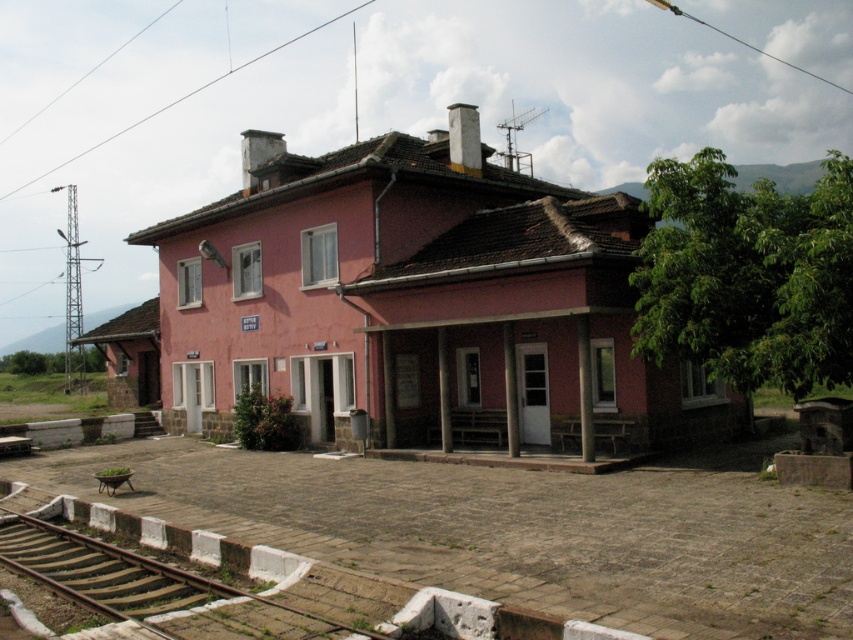
You are a delivery person trying to park your van in front of the pink brick building at center. The van is 2 meters wide. The brown wooden train track at lower left is 1.5 meters wide. Can the van park between the building and the train track without overlapping them?

The pink brick building at center is positioned over the brown wooden train track at lower left, so the van cannot park between them as they are overlapping.

You are a delivery person trying to park your 3.5m long van in the paved area in front of the pink brick building at center. The brown wooden train track at lower left is nearby. Considering the size of the building and the track, do you think there is enough space to park your van without blocking the train track?

The pink brick building at center is bigger than the brown wooden train track at lower left. However, the exact dimensions of the paved area are not provided, so it is uncertain whether there is enough space to park the van without blocking the track.